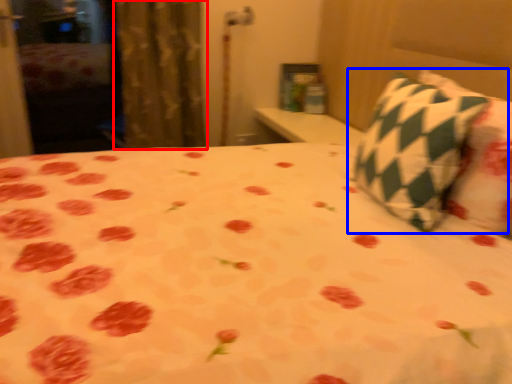
Question: Among these objects, which one is farthest to the camera, curtain (highlighted by a red box) or pillow (highlighted by a blue box)?

Choices:
 (A) curtain
 (B) pillow

Answer: (A)